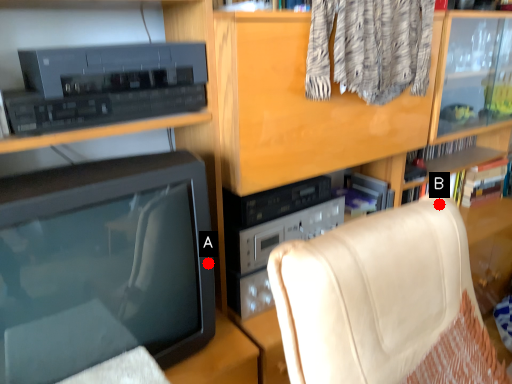
Question: Two points are circled on the image, labeled by A and B beside each circle. Which point is farther from the camera taking this photo?

Choices:
 (A) A is further
 (B) B is further

Answer: (A)